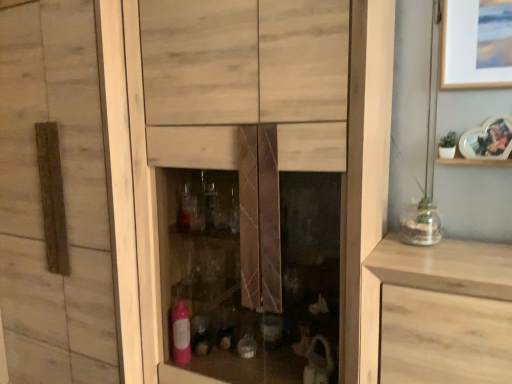
Question: Does wooden shelf at upper right have a greater height compared to heart-shaped photo frame at upper right?

Choices:
 (A) yes
 (B) no

Answer: (B)

Question: Is wooden shelf at upper right smaller than heart-shaped photo frame at upper right?

Choices:
 (A) no
 (B) yes

Answer: (B)

Question: Would you say wooden shelf at upper right is a long distance from heart-shaped photo frame at upper right?

Choices:
 (A) yes
 (B) no

Answer: (B)

Question: Does wooden shelf at upper right contain heart-shaped photo frame at upper right?

Choices:
 (A) no
 (B) yes

Answer: (A)

Question: Can you confirm if wooden shelf at upper right is wider than heart-shaped photo frame at upper right?

Choices:
 (A) no
 (B) yes

Answer: (B)

Question: Is wooden shelf at upper right looking in the opposite direction of heart-shaped photo frame at upper right?

Choices:
 (A) no
 (B) yes

Answer: (A)

Question: Is clear glass vase at right surrounded by light wood drawer at right?

Choices:
 (A) no
 (B) yes

Answer: (A)

Question: Are light wood drawer at right and clear glass vase at right located far from each other?

Choices:
 (A) no
 (B) yes

Answer: (A)

Question: Does light wood drawer at right lie behind clear glass vase at right?

Choices:
 (A) yes
 (B) no

Answer: (B)

Question: Can you confirm if light wood drawer at right is thinner than clear glass vase at right?

Choices:
 (A) yes
 (B) no

Answer: (B)

Question: Is light wood drawer at right outside clear glass vase at right?

Choices:
 (A) yes
 (B) no

Answer: (A)

Question: From a real-world perspective, does light wood drawer at right stand above clear glass vase at right?

Choices:
 (A) yes
 (B) no

Answer: (B)

Question: Does heart-shaped photo frame at upper right have a lesser width compared to wooden shelf at upper right?

Choices:
 (A) yes
 (B) no

Answer: (A)